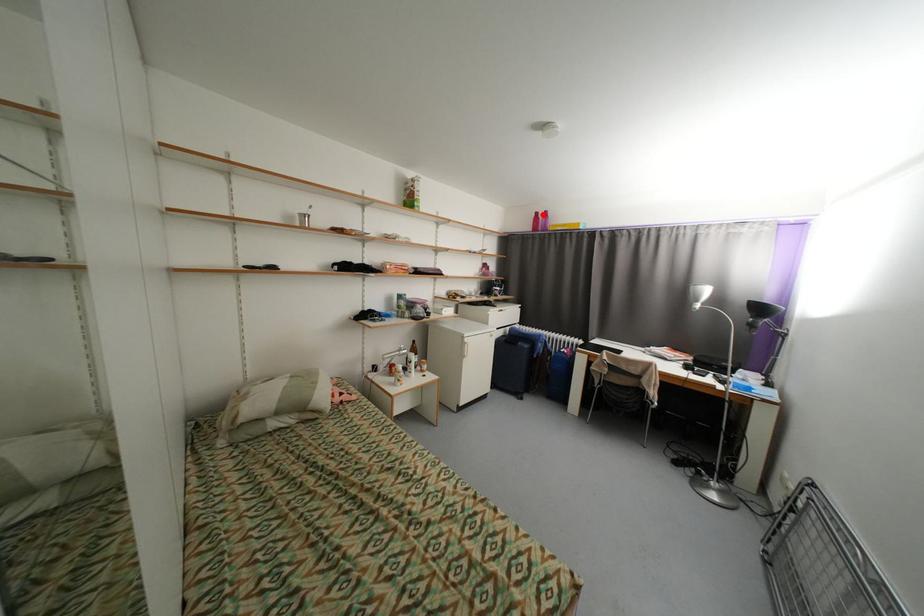
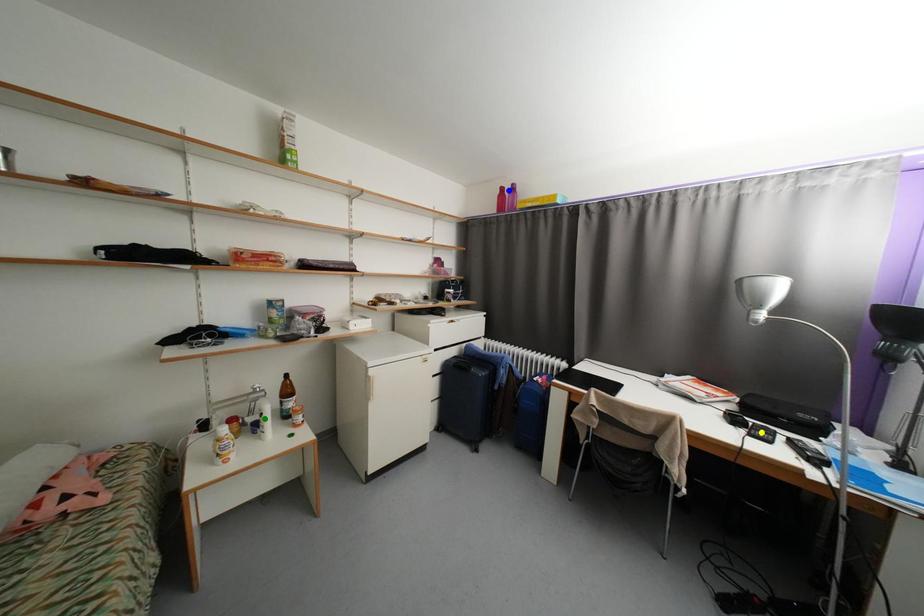
Question: I am providing you with two images of the same scene from different viewpoints. A red point is marked on the first image. You are given multiple points on the second image. Which mark in image 2 goes with the point in image 1?

Choices:
 (A) blue point
 (B) green point
 (C) yellow point

Answer: (A)